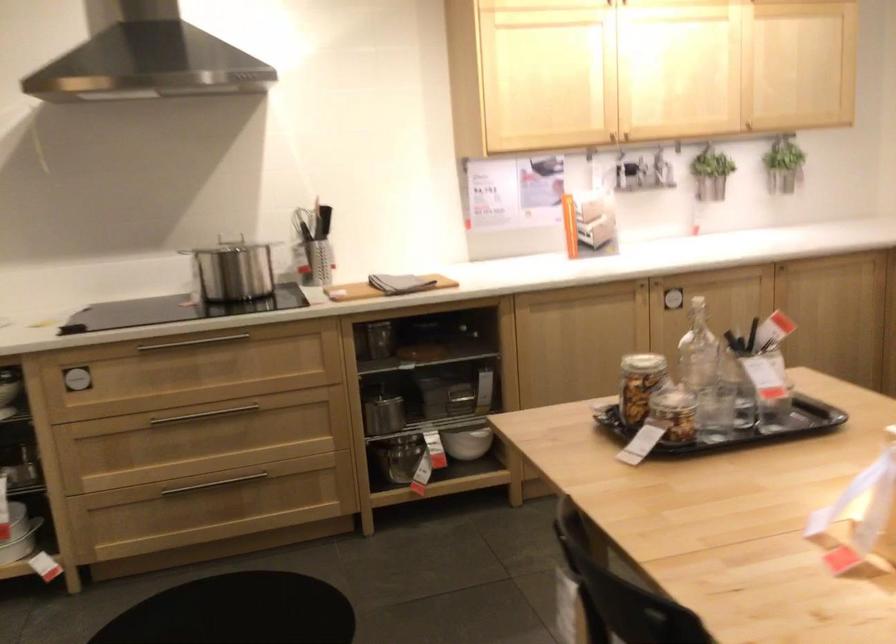
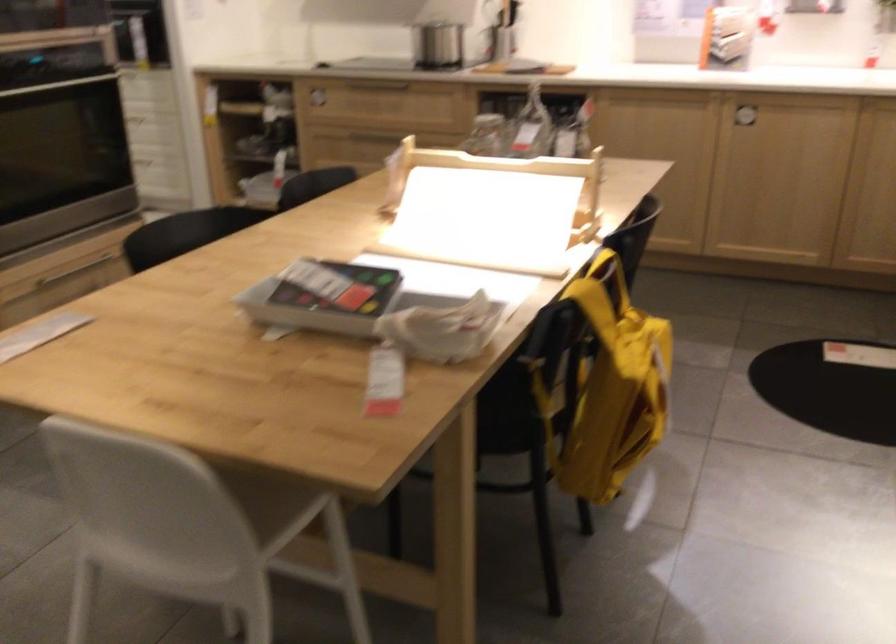
Question: I am providing you with two images of the same scene from different viewpoints. Which of the following objects are not visible in image2?

Choices:
 (A) white and red bowl
 (B) cabinet handle
 (C) metal drawer handle
 (D) white chair sitting surface

Answer: (C)